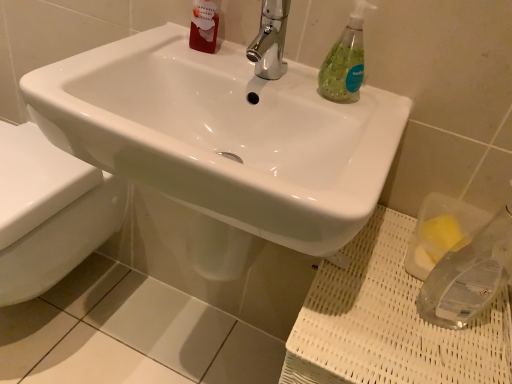
The width and height of the screenshot is (512, 384). What are the coordinates of `spots to the right of green translucent soap dispenser at upper right` in the screenshot? It's located at (381, 109).